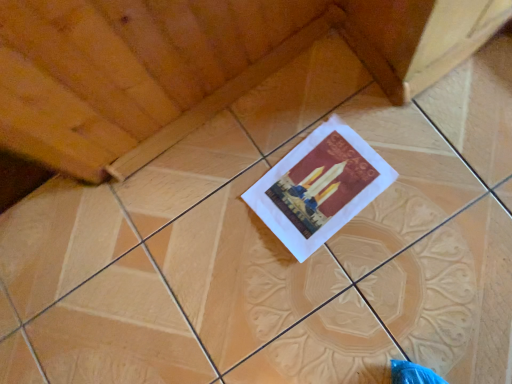
At what (x,y) coordinates should I click in order to perform the action: click on vacant area on the back side of matte paper postcard at center. Please return your answer as a coordinate pair (x, y). The width and height of the screenshot is (512, 384). Looking at the image, I should click on (263, 127).